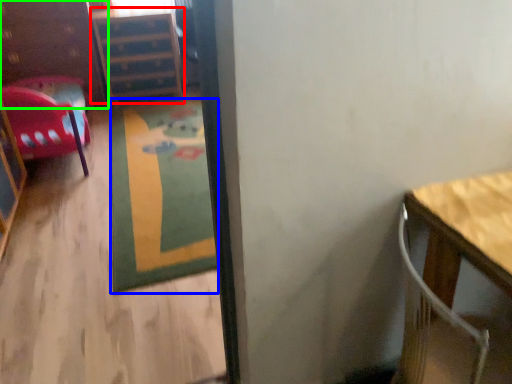
Question: Based on their relative distances, which object is nearer to file cabinet (highlighted by a red box)? Choose from mat (highlighted by a blue box) and dresser (highlighted by a green box).

Choices:
 (A) mat
 (B) dresser

Answer: (B)